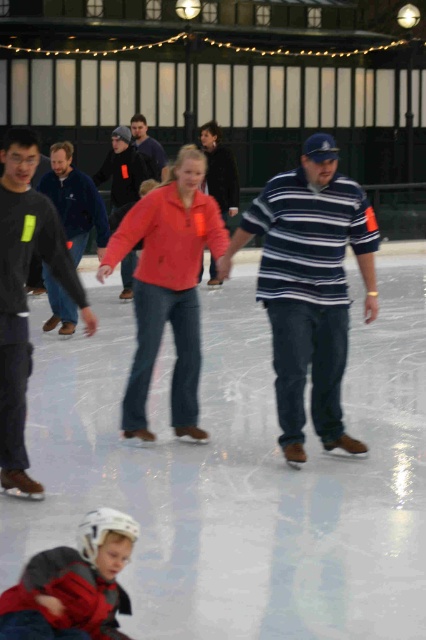
Is matte blue jacket at center below matte pink jacket at center?

Yes, matte blue jacket at center is below matte pink jacket at center.

Is matte blue jacket at center to the left of matte pink jacket at center from the viewer's perspective?

Yes, matte blue jacket at center is to the left of matte pink jacket at center.

This screenshot has width=426, height=640. What do you see at coordinates (74, 202) in the screenshot? I see `matte blue jacket at center` at bounding box center [74, 202].

Where is `matte blue jacket at center`? matte blue jacket at center is located at coordinates (74, 202).

Can you confirm if matte pink jacket at center is positioned below orange fleece jacket at center?

Yes, matte pink jacket at center is below orange fleece jacket at center.

Is point (204, 138) less distant than point (140, 129)?

Yes.

The width and height of the screenshot is (426, 640). What do you see at coordinates (219, 170) in the screenshot?
I see `matte pink jacket at center` at bounding box center [219, 170].

Find the location of a particular element. matte pink jacket at center is located at coordinates (219, 170).

Is red matte jacket at center shorter than orange fleece jacket at center?

In fact, red matte jacket at center may be taller than orange fleece jacket at center.

Between red matte jacket at center and orange fleece jacket at center, which one appears on the right side from the viewer's perspective?

Positioned to the right is red matte jacket at center.

I want to click on red matte jacket at center, so click(167, 289).